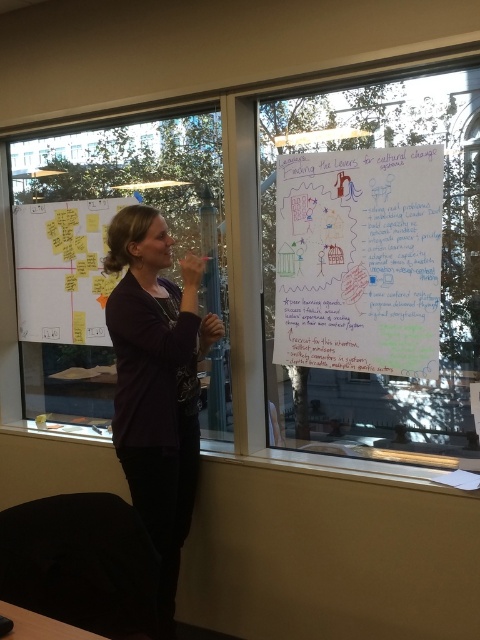
Question: Is transparent glass window at upper center above whiteboard at upper center?

Choices:
 (A) no
 (B) yes

Answer: (A)

Question: Which point is closer to the camera taking this photo?

Choices:
 (A) (294, 269)
 (B) (210, 212)

Answer: (A)

Question: Is whiteboard at upper right below yellow sticky notes at left?

Choices:
 (A) no
 (B) yes

Answer: (B)

Question: Which point is closer to the camera?

Choices:
 (A) whiteboard at upper right
 (B) matte purple sweater at center

Answer: (A)

Question: Which object is farther from the camera taking this photo?

Choices:
 (A) matte purple sweater at center
 (B) yellow sticky notes at left
 (C) whiteboard at upper right
 (D) whiteboard at upper center

Answer: (B)

Question: Is whiteboard at upper right in front of whiteboard at upper center?

Choices:
 (A) no
 (B) yes

Answer: (B)